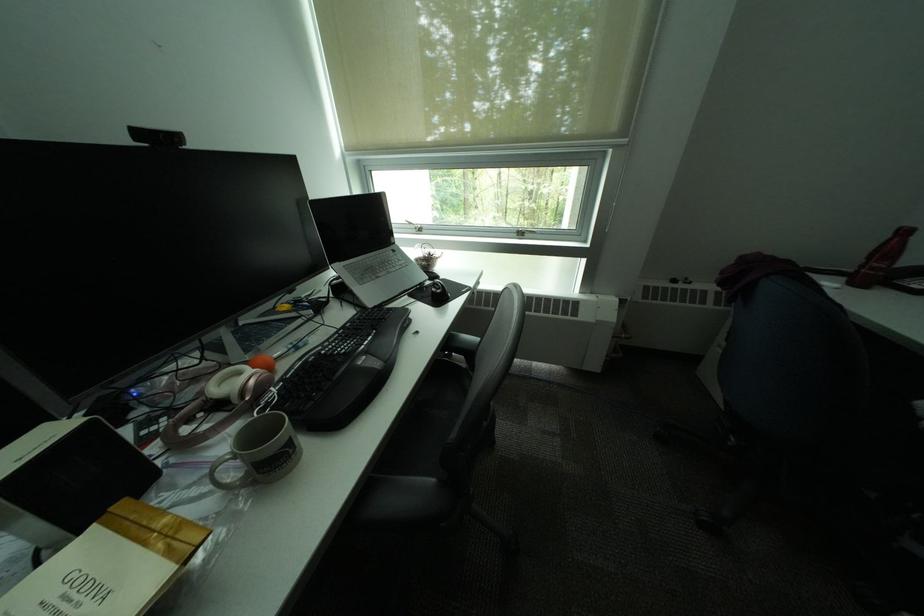
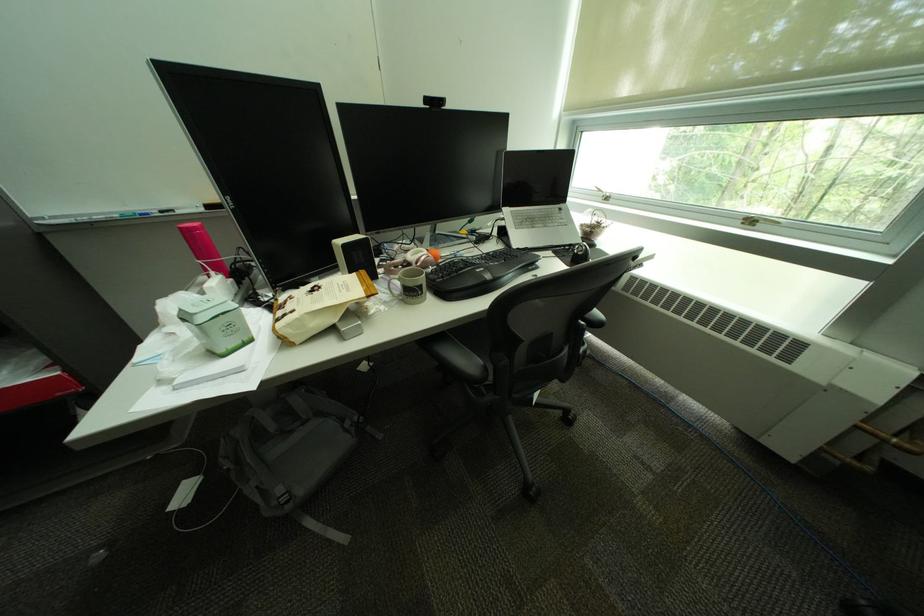
Where in the second image is the point corresponding to (x=313, y=362) from the first image?

(463, 261)